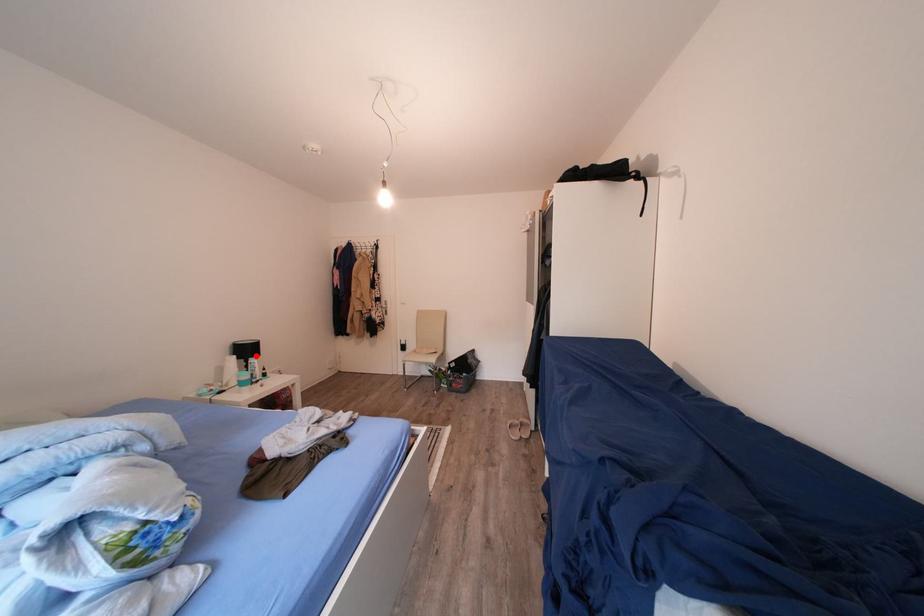
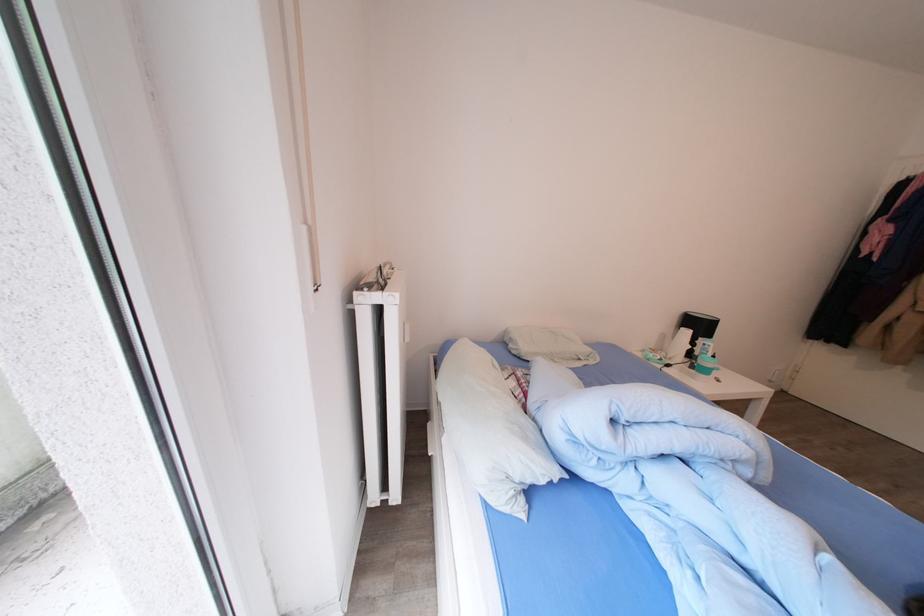
The point at the highlighted location is marked in the first image. Where is the corresponding point in the second image?

(708, 331)